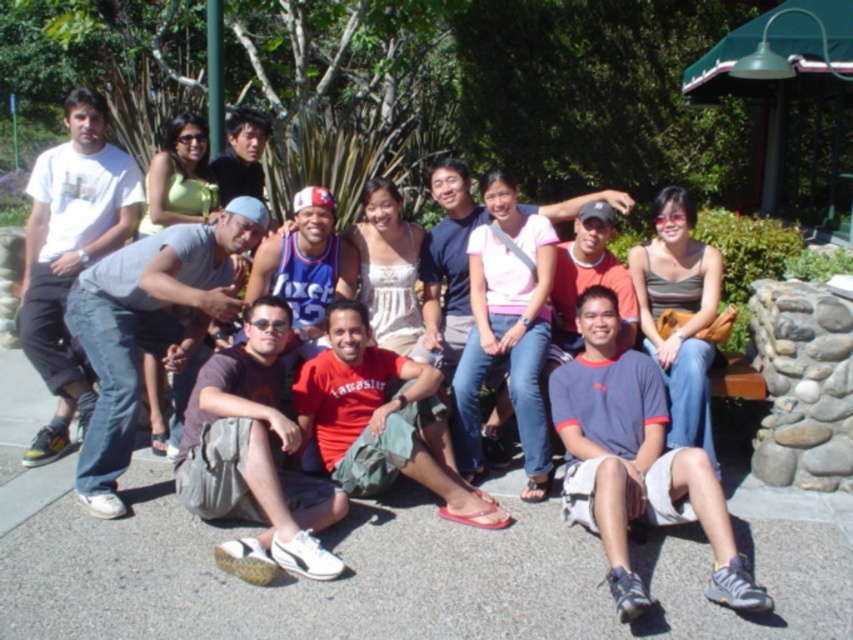
Question: Which object is farther from the camera taking this photo?

Choices:
 (A) red shirt at center
 (B) red matte shirt at center

Answer: (A)

Question: Can you confirm if white t-shirt at left is positioned below red shirt at center?

Choices:
 (A) no
 (B) yes

Answer: (A)

Question: Is gray cotton shirt at center above red shirt at center?

Choices:
 (A) no
 (B) yes

Answer: (A)

Question: Does white t-shirt at left appear under blue jersey at center?

Choices:
 (A) yes
 (B) no

Answer: (B)

Question: Which object is the closest to the red shirt at center?

Choices:
 (A) gray cotton shirt at center
 (B) red matte shirt at center

Answer: (A)

Question: Among these points, which one is nearest to the camera?

Choices:
 (A) tap(196, 508)
 (B) tap(96, 150)

Answer: (A)